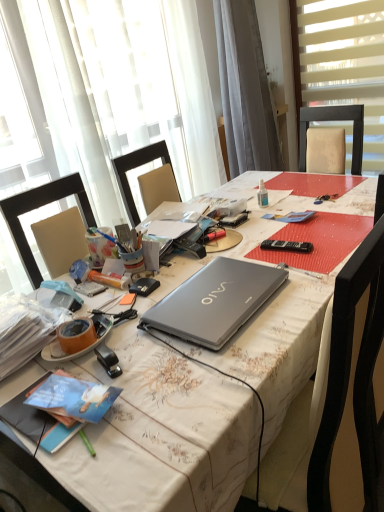
Where is `vacant area on the back side of clear plastic bottle at center`? This screenshot has height=512, width=384. vacant area on the back side of clear plastic bottle at center is located at coordinates (268, 193).